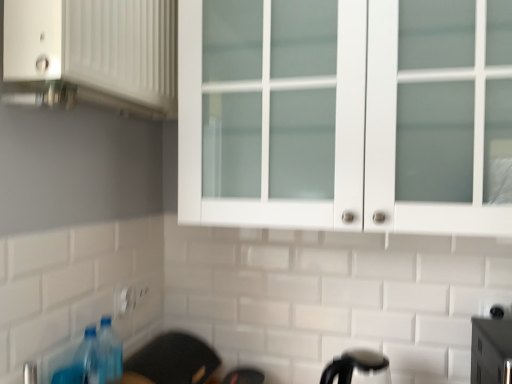
Question: Considering the positions of white matte cabinet at upper left and white plastic electric outlet at lower center in the image, is white matte cabinet at upper left bigger or smaller than white plastic electric outlet at lower center?

Choices:
 (A) small
 (B) big

Answer: (B)

Question: In terms of height, does white matte cabinet at upper left look taller or shorter compared to white plastic electric outlet at lower center?

Choices:
 (A) short
 (B) tall

Answer: (B)

Question: Estimate the real-world distances between objects in this image. Which object is closer to the white matte cabinet at upper left?

Choices:
 (A) white glass cabinet at upper center
 (B) white plastic electric outlet at lower center
 (C) blue plastic bottle at lower left
 (D) black plastic kettle at lower center

Answer: (A)

Question: Which object is the farthest from the white matte cabinet at upper left?

Choices:
 (A) blue plastic bottle at lower left
 (B) black plastic kettle at lower center
 (C) white glass cabinet at upper center
 (D) white plastic electric outlet at lower center

Answer: (B)